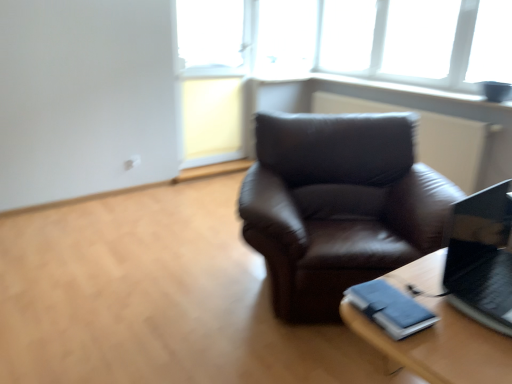
This screenshot has height=384, width=512. Find the location of `vacant space positioned to the left of shiny black laptop at right`. vacant space positioned to the left of shiny black laptop at right is located at coordinates tap(420, 300).